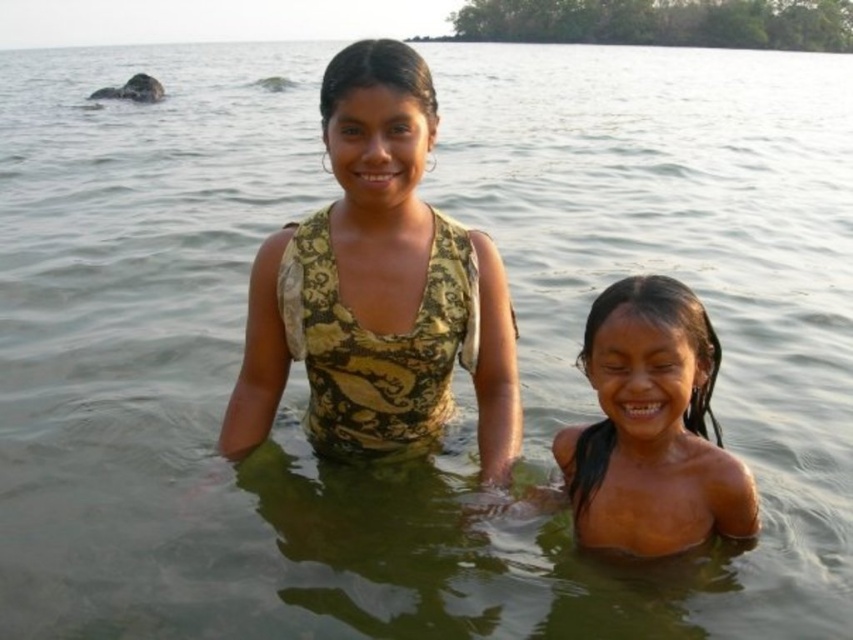
What do you see at coordinates (378, 288) in the screenshot? Image resolution: width=853 pixels, height=640 pixels. I see `camouflage fabric top at center` at bounding box center [378, 288].

Can you confirm if camouflage fabric top at center is positioned below dry skin at center?

Incorrect, camouflage fabric top at center is not positioned below dry skin at center.

This screenshot has height=640, width=853. What do you see at coordinates (378, 288) in the screenshot? I see `camouflage fabric top at center` at bounding box center [378, 288].

Locate an element on the screen. The width and height of the screenshot is (853, 640). camouflage fabric top at center is located at coordinates (378, 288).